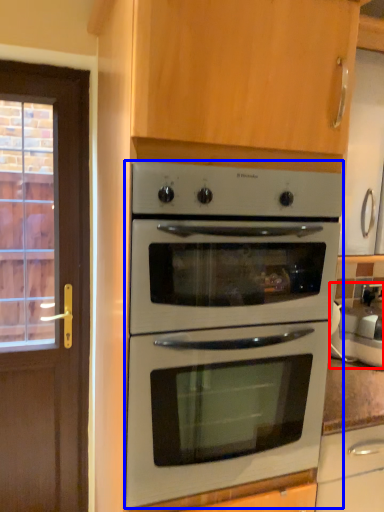
Question: Which object appears farthest to the camera in this image, appliance (highlighted by a red box) or oven (highlighted by a blue box)?

Choices:
 (A) appliance
 (B) oven

Answer: (A)